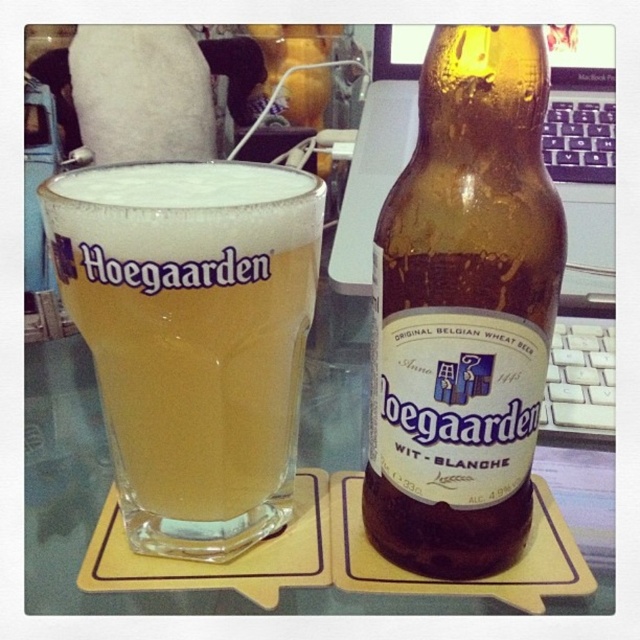
You are holding a pen and want to draw a line connecting the two points, point (522, 472) and point (225, 188), on the image. Before drawing, you need to determine which point is closer to you. Which point should you start drawing from if you want to begin at the closer one?

Point (225, 188) is closer to you than point (522, 472), so you should start drawing from point (225, 188).

You are arranging items on a shelf and need to know the order of the golden glass at center and brown glass bottle at center from front to back. Based on the scene, which one is closer to the front?

The brown glass bottle at center is closer to the front because the golden glass at center is behind it.